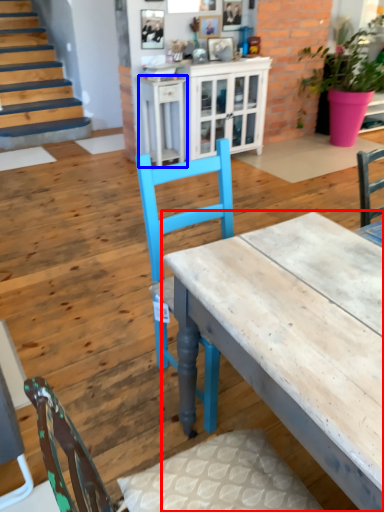
Question: Among these objects, which one is nearest to the camera, desk (highlighted by a red box) or table (highlighted by a blue box)?

Choices:
 (A) desk
 (B) table

Answer: (A)